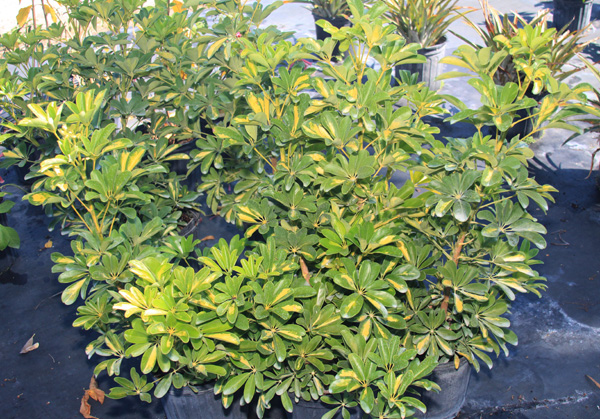
Image resolution: width=600 pixels, height=419 pixels. I want to click on vases, so click(437, 51).